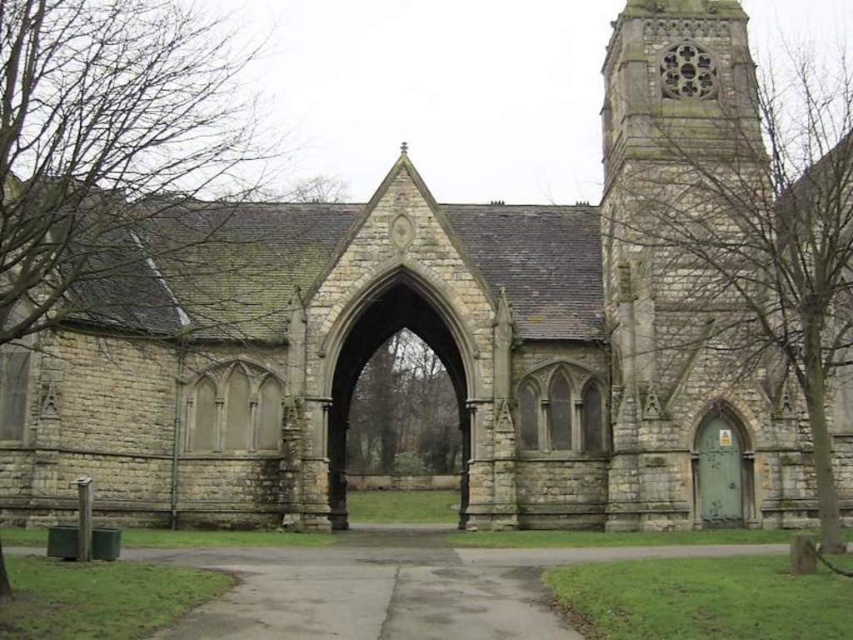
Question: Which of these objects is positioned closest to the bare branches at left?

Choices:
 (A) green leafy tree at center
 (B) green stone tree at right

Answer: (A)

Question: Which is farther from the green leafy tree at center?

Choices:
 (A) bare branches at left
 (B) green stone tree at right

Answer: (B)

Question: Does green stone tree at right lie behind bare branches at left?

Choices:
 (A) yes
 (B) no

Answer: (A)

Question: Does bare branches at left appear on the left side of green leafy tree at center?

Choices:
 (A) no
 (B) yes

Answer: (B)

Question: Does green stone tree at right have a lesser width compared to bare branches at left?

Choices:
 (A) yes
 (B) no

Answer: (B)

Question: Which object appears closest to the camera in this image?

Choices:
 (A) bare branches at left
 (B) green leafy tree at center

Answer: (A)